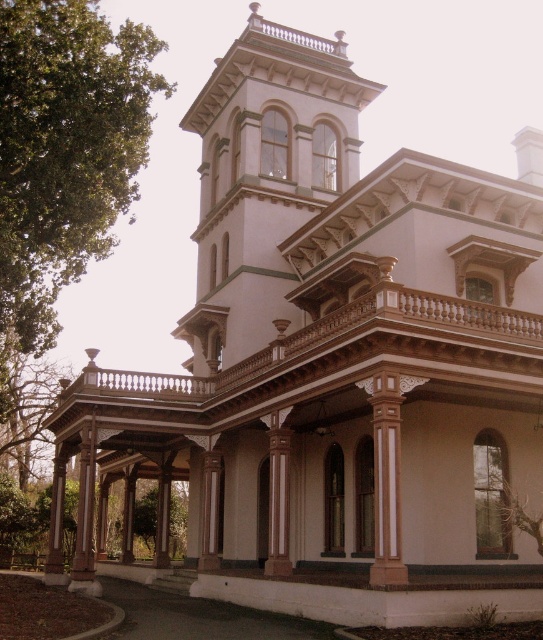
Question: Does white painted wood bell tower at upper center appear over wooden carved balcony at center?

Choices:
 (A) no
 (B) yes

Answer: (B)

Question: In this image, where is white painted wood bell tower at upper center located relative to wooden carved balcony at center?

Choices:
 (A) above
 (B) below

Answer: (A)

Question: Among these objects, which one is farthest from the camera?

Choices:
 (A) wooden carved balcony at center
 (B) white painted wood bell tower at upper center

Answer: (B)

Question: Does white painted wood bell tower at upper center have a greater width compared to wooden carved balcony at center?

Choices:
 (A) yes
 (B) no

Answer: (B)

Question: Which point is farther from the camera taking this photo?

Choices:
 (A) (217, 243)
 (B) (425, 332)

Answer: (A)